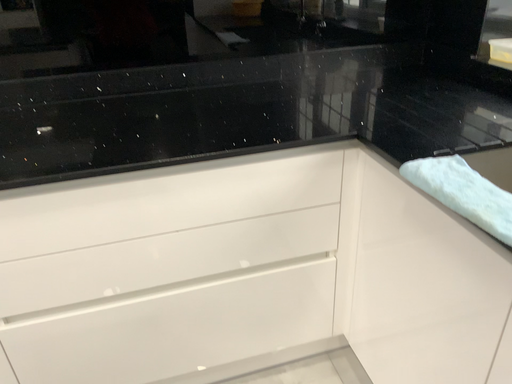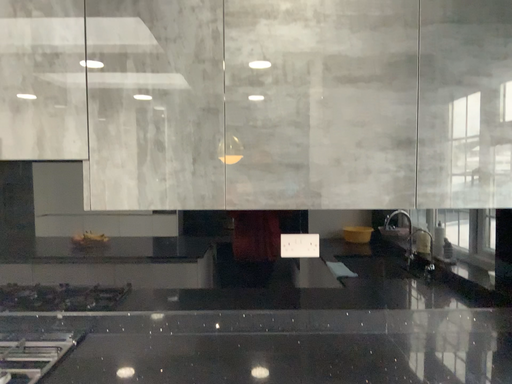
Question: How did the camera likely rotate when shooting the video?

Choices:
 (A) rotated upward
 (B) rotated downward

Answer: (A)